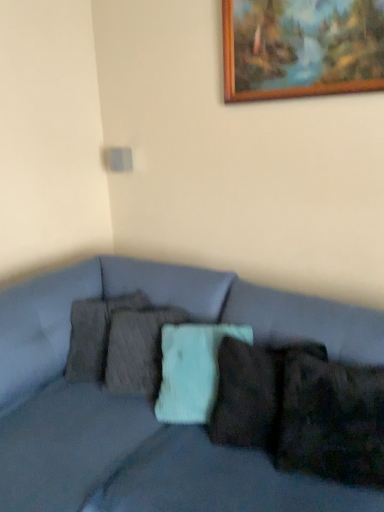
Question: Would you say matte gray couch at center is inside or outside wooden picture frame at upper center?

Choices:
 (A) outside
 (B) inside

Answer: (A)

Question: From a real-world perspective, relative to wooden picture frame at upper center, is matte gray couch at center vertically above or below?

Choices:
 (A) below
 (B) above

Answer: (A)

Question: Considering the real-world distances, which object is farthest from the wooden picture frame at upper center?

Choices:
 (A) textured gray pillow at center, positioned as the first pillow in back-to-front order
 (B) matte gray couch at center
 (C) velvety brown pillow at lower right, marked as the 1th pillow in a front-to-back arrangement

Answer: (A)

Question: Which of these objects is positioned closest to the textured gray pillow at center, the 2th pillow positioned from the front?

Choices:
 (A) wooden picture frame at upper center
 (B) matte gray couch at center
 (C) velvety brown pillow at lower right, marked as the 1th pillow in a front-to-back arrangement

Answer: (B)